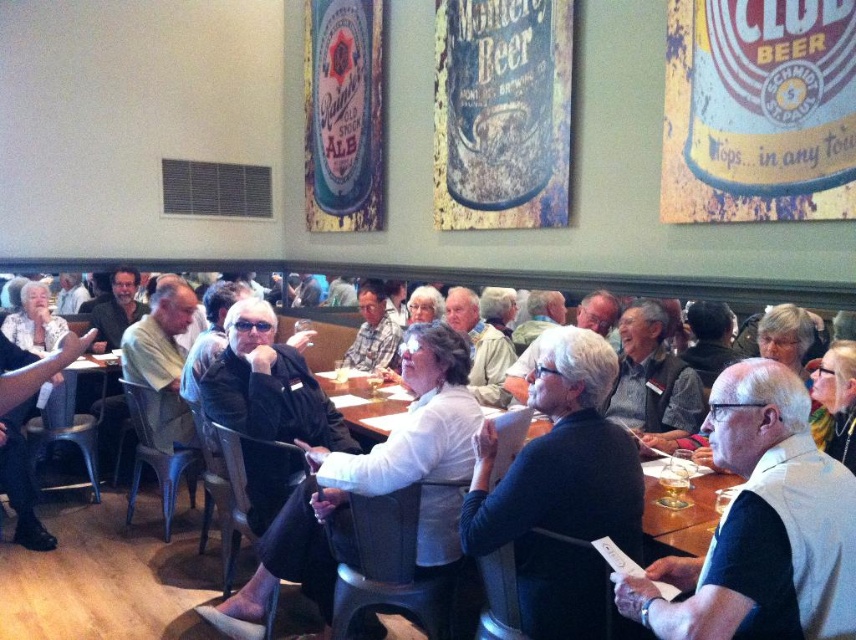
Is white fabric vest at center closer to camera compared to white shirt at center?

Yes, it is in front of white shirt at center.

Can you confirm if white fabric vest at center is taller than white shirt at center?

Yes, white fabric vest at center is taller than white shirt at center.

Does point (776, 378) come closer to viewer compared to point (391, 413)?

Yes, it is in front of point (391, 413).

I want to click on white fabric vest at center, so click(761, 525).

In the scene shown: Between white fabric vest at center and black leather jacket at center, which one appears on the left side from the viewer's perspective?

black leather jacket at center is more to the left.

Does point (727, 612) come farther from viewer compared to point (370, 634)?

No.

Locate an element on the screen. Image resolution: width=856 pixels, height=640 pixels. white fabric vest at center is located at coordinates (761, 525).

In order to click on white fabric vest at center in this screenshot , I will do `click(761, 525)`.

Is white shirt at center wider than black matte sweater at center?

Indeed, white shirt at center has a greater width compared to black matte sweater at center.

Based on the photo, who is shorter, white shirt at center or black matte sweater at center?

Standing shorter between the two is white shirt at center.

Between point (159, 620) and point (601, 412), which one is positioned behind?

Positioned behind is point (601, 412).

Image resolution: width=856 pixels, height=640 pixels. Find the location of `white shirt at center`. white shirt at center is located at coordinates (111, 572).